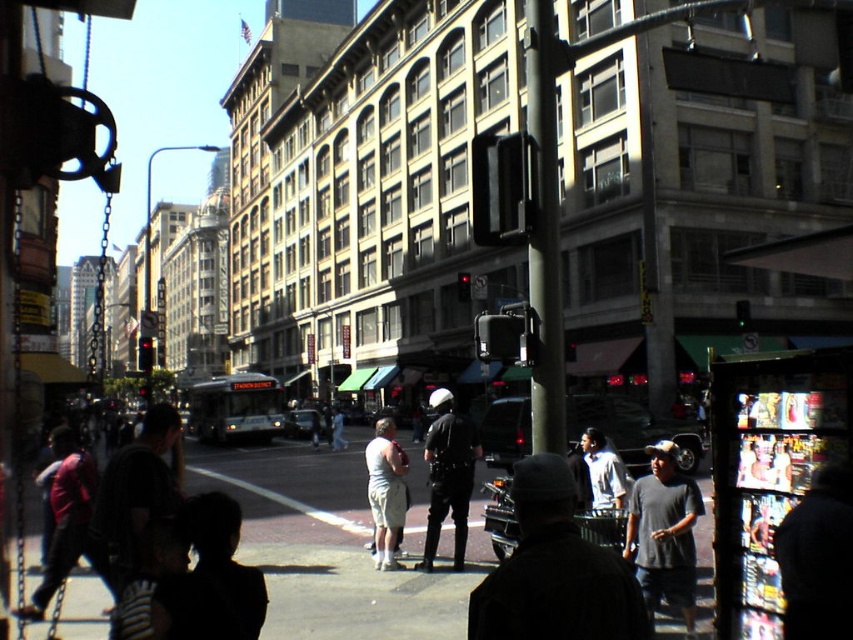
Question: Does dark gray jacket at center come behind light beige shorts at center?

Choices:
 (A) no
 (B) yes

Answer: (A)

Question: Among these objects, which one is farthest from the camera?

Choices:
 (A) white matte shorts at center
 (B) dark gray jacket at center

Answer: (A)

Question: Which point is closer to the camera taking this photo?

Choices:
 (A) (335, 435)
 (B) (59, 476)

Answer: (B)

Question: Based on their relative distances, which object is nearer to the dark gray knit cap at center?

Choices:
 (A) light beige shorts at center
 (B) red shirt at left
 (C) dark blue jacket at lower right
 (D) gray cotton t-shirt at center-right

Answer: (C)

Question: Where is shiny black uniform at center located in relation to white matte shorts at center in the image?

Choices:
 (A) below
 (B) above

Answer: (B)

Question: Does light gray shirt at center have a lesser width compared to white matte shorts at center?

Choices:
 (A) yes
 (B) no

Answer: (A)